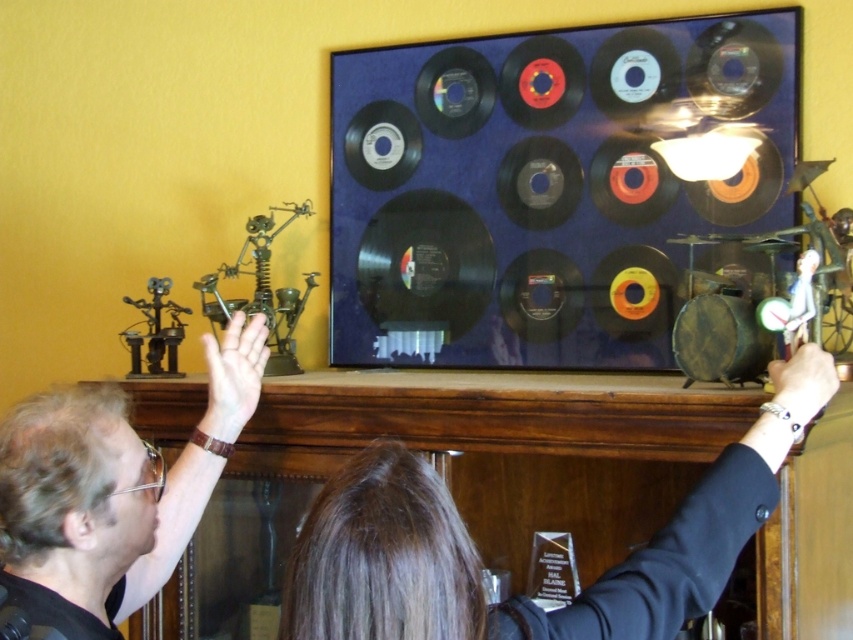
You are a photographer trying to capture a portrait of the two people in the scene. You want to ensure that both the brown hair at upper center and the matte black shirt at upper left are clearly visible in the frame. Based on their positions, which object should you focus on first to ensure both are in focus?

You should focus on the matte black shirt at upper left first because the brown hair at upper center is to the right of it, so adjusting focus starting from the left ensures both are in the frame.

Looking at this image, you are a photographer trying to capture a clear shot of both the brown hair at upper center and the matte black shirt at upper left. Since you want both subjects in focus, which one should you adjust your camera focus to prioritize first?

The brown hair at upper center is above the matte black shirt at upper left, so you should prioritize focusing on the brown hair at upper center first to ensure both are in focus.

You are a photographer holding a camera. You want to take a photo of the brown hair at upper center without getting too close. Given that the minimum focusing distance of your camera is 80 centimeters, can you take the photo from your current position?

The distance between the brown hair at upper center and the camera is 80.87 centimeters. Since this is slightly more than the minimum focusing distance of 80 centimeters, you can take the photo from your current position.